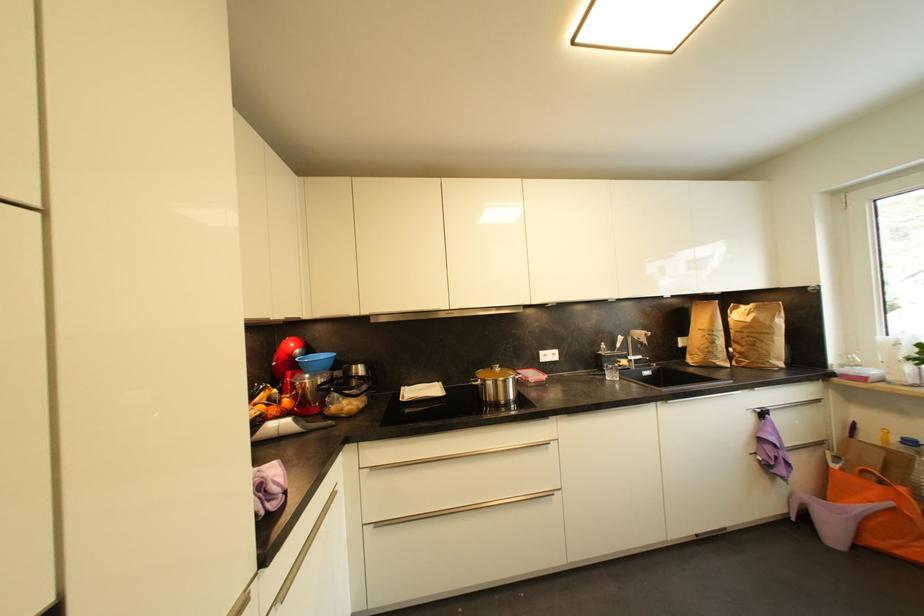
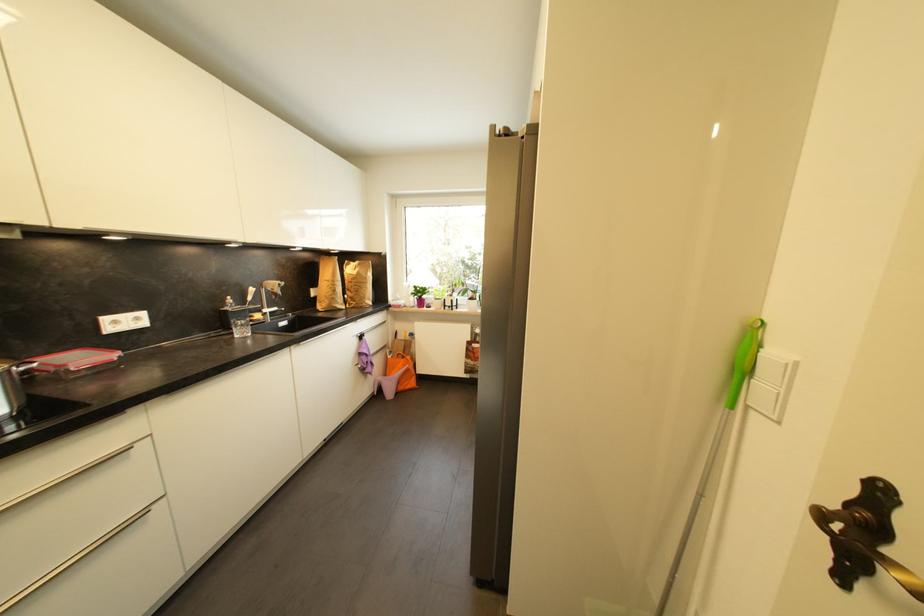
In the second image, find the point that corresponds to (840,468) in the first image.

(395, 359)